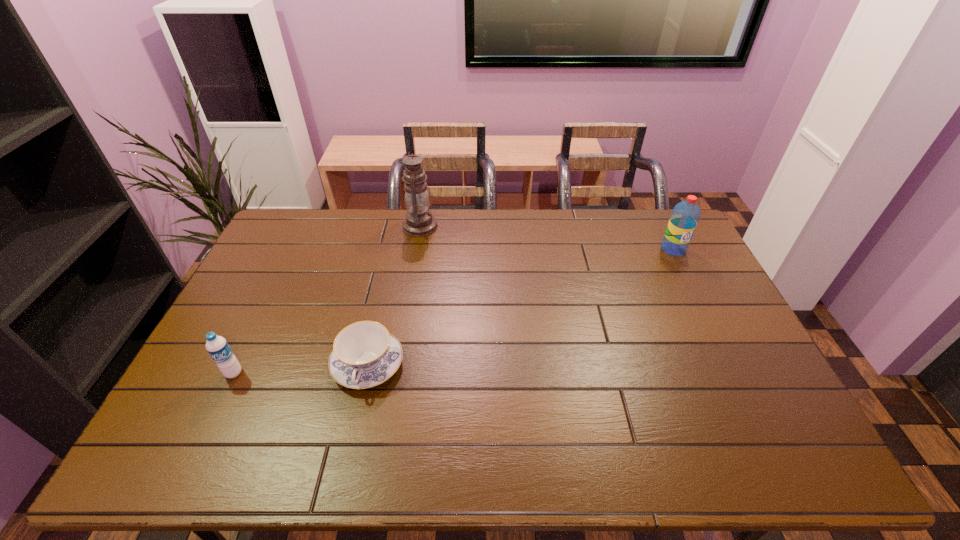
Where is `oil lamp`? This screenshot has height=540, width=960. oil lamp is located at coordinates (419, 221).

Locate an element on the screen. The width and height of the screenshot is (960, 540). the farthest object is located at coordinates (419, 221).

Identify the location of the second farthest object. (685, 216).

Locate an element on the screen. the second tallest object is located at coordinates (685, 216).

This screenshot has width=960, height=540. What are the coordinates of `the shorter water bottle` in the screenshot? It's located at (218, 348).

Locate an element on the screen. The image size is (960, 540). the left water bottle is located at coordinates (218, 348).

Locate an element on the screen. The width and height of the screenshot is (960, 540). chinaware is located at coordinates (365, 354).

At what (x,y) coordinates should I click in order to perform the action: click on vacant region located 0.280m on the right of the farthest object. Please return your answer as a coordinate pair (x, y). The image size is (960, 540). Looking at the image, I should click on (511, 226).

The width and height of the screenshot is (960, 540). In order to click on vacant space situated on the front label of the third nearest object in this screenshot , I will do `click(696, 296)`.

I want to click on vacant space located 0.140m on the label of the third tallest object, so click(x=206, y=429).